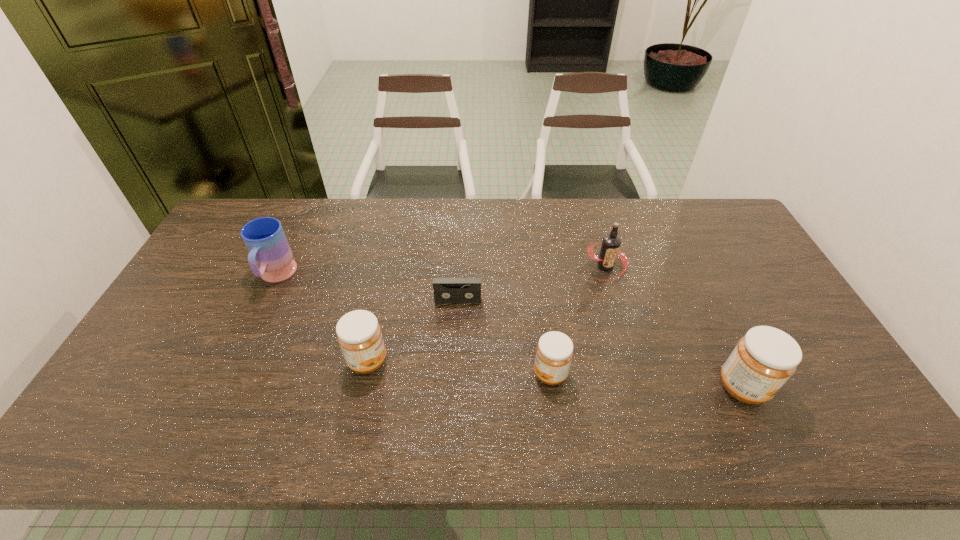
The jams are evenly distributed in the image. To maintain this, where would you place another jam on the left? Please point to a free space. Please provide its 2D coordinates. Your answer should be formatted as a tuple, i.e. [(x, y)], where the tuple contains the x and y coordinates of a point satisfying the conditions above.

[(193, 349)]